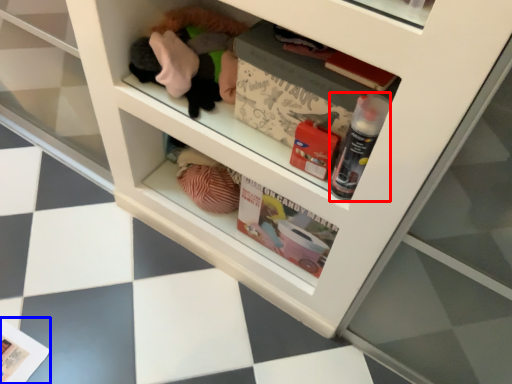
Question: Which point is further to the camera, bottle (highlighted by a red box) or magazine (highlighted by a blue box)?

Choices:
 (A) bottle
 (B) magazine

Answer: (B)